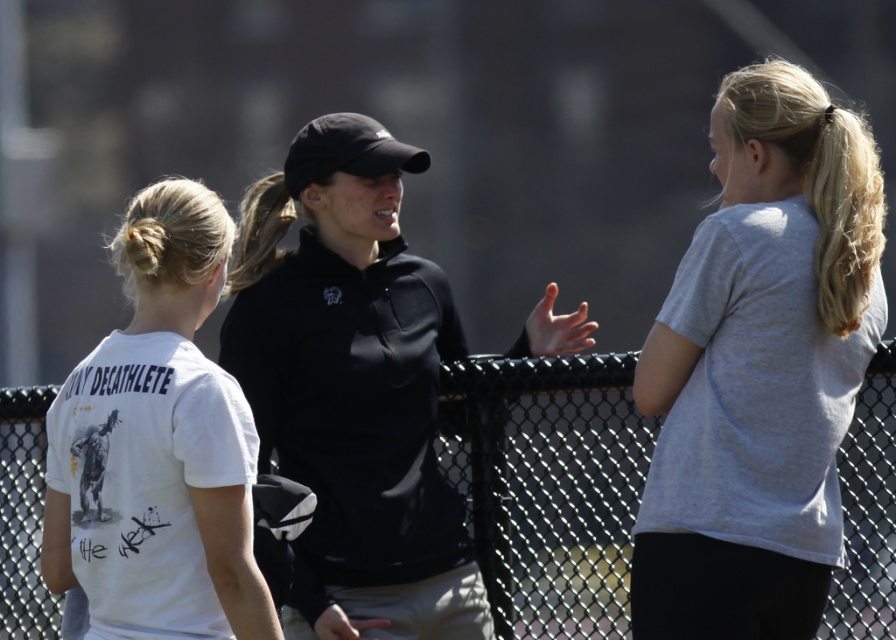
Question: Can you confirm if gray matte t-shirt at upper right is positioned to the right of black chain-link fence at center?

Choices:
 (A) yes
 (B) no

Answer: (A)

Question: Which of the following is the farthest from the observer?

Choices:
 (A) black matte jacket at center
 (B) black chain-link fence at center

Answer: (A)

Question: Among these objects, which one is farthest from the camera?

Choices:
 (A) white matte t-shirt at center
 (B) black matte jacket at center
 (C) gray matte t-shirt at upper right

Answer: (B)

Question: Which point appears farthest from the camera in this image?

Choices:
 (A) (862, 269)
 (B) (425, 548)
 (C) (876, 552)

Answer: (B)

Question: Can you confirm if black matte jacket at center is smaller than black chain-link fence at center?

Choices:
 (A) yes
 (B) no

Answer: (B)

Question: Is the position of gray matte t-shirt at upper right less distant than that of black matte jacket at center?

Choices:
 (A) no
 (B) yes

Answer: (B)